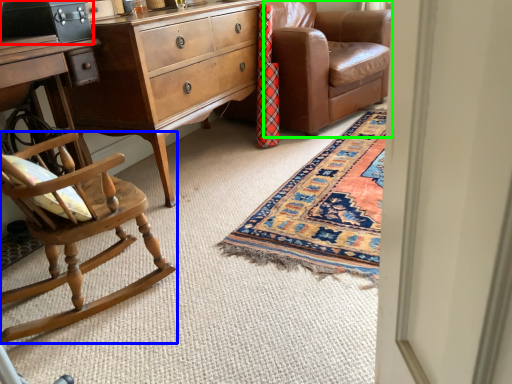
Question: Based on their relative distances, which object is farther from cabinetry (highlighted by a red box)? Choose from chair (highlighted by a blue box) and studio couch (highlighted by a green box).

Choices:
 (A) chair
 (B) studio couch

Answer: (B)